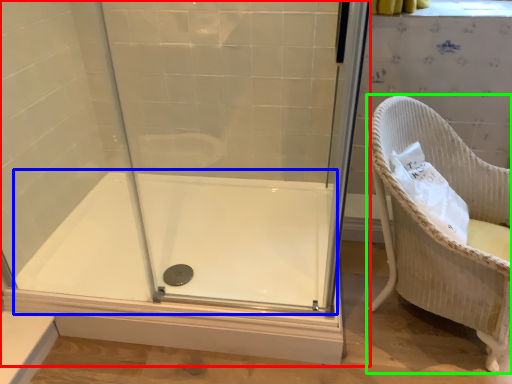
Question: Based on their relative distances, which object is nearer to shower door (highlighted by a red box)? Choose from bath (highlighted by a blue box) and furniture (highlighted by a green box).

Choices:
 (A) bath
 (B) furniture

Answer: (A)